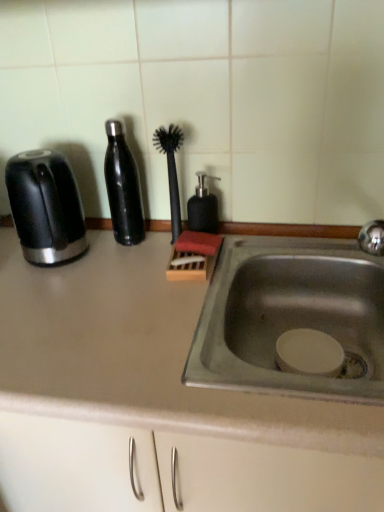
The height and width of the screenshot is (512, 384). What are the coordinates of `free space that is in between black glossy toaster at left and satin black bottle at center left` in the screenshot? It's located at (101, 252).